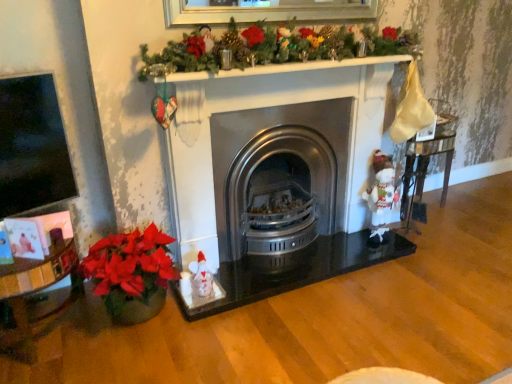
The image size is (512, 384). What are the coordinates of `free space in front of white plush santa at right` in the screenshot? It's located at (378, 265).